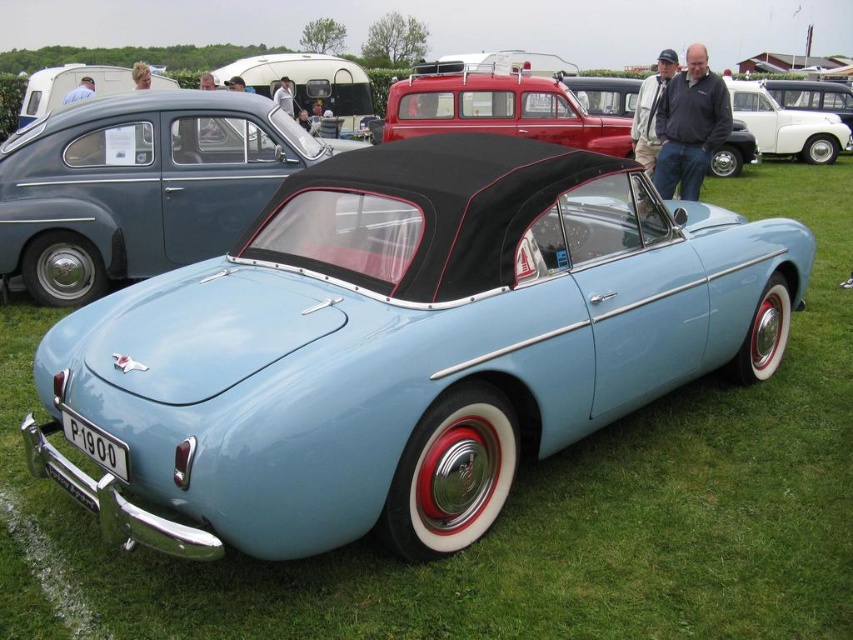
Question: Does light blue matte convertible at center appear on the right side of metallic red station wagon at center?

Choices:
 (A) no
 (B) yes

Answer: (A)

Question: Does metallic red station wagon at center have a lesser width compared to white glossy van at upper center?

Choices:
 (A) yes
 (B) no

Answer: (B)

Question: Which point is farther to the camera?

Choices:
 (A) (201, 253)
 (B) (496, 115)
 (C) (820, 163)

Answer: (C)

Question: Which point appears closest to the camera in this image?

Choices:
 (A) (817, 148)
 (B) (462, 83)
 (C) (28, 173)

Answer: (C)

Question: Observing the image, what is the correct spatial positioning of light blue matte convertible at center in reference to white glossy van at upper center?

Choices:
 (A) right
 (B) left

Answer: (B)

Question: Which object appears farthest from the camera in this image?

Choices:
 (A) metallic red station wagon at center
 (B) light blue matte convertible at center

Answer: (A)